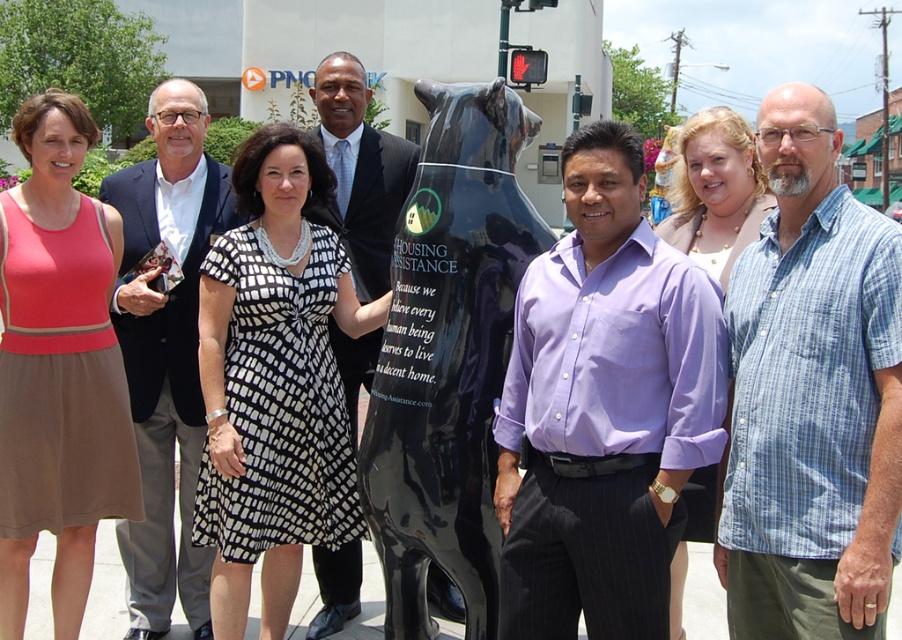
Question: Which point is farther from the camera taking this photo?

Choices:
 (A) (272, 468)
 (B) (726, 140)

Answer: (A)

Question: Can you confirm if purple cotton shirt at center is wider than light brown suit at center?

Choices:
 (A) no
 (B) yes

Answer: (B)

Question: Which point is farther to the camera?

Choices:
 (A) light brown suit at center
 (B) purple cotton shirt at center
 (C) pink fabric dress at left
 (D) pearl necklace at center

Answer: (A)

Question: Is shiny black suit at center to the right of pearl necklace at center from the viewer's perspective?

Choices:
 (A) yes
 (B) no

Answer: (B)

Question: Which of the following is the farthest from the observer?

Choices:
 (A) (192, 385)
 (B) (716, 168)
 (C) (779, 228)

Answer: (A)

Question: Is black glossy bear at center further to the viewer compared to shiny black suit at center?

Choices:
 (A) yes
 (B) no

Answer: (B)